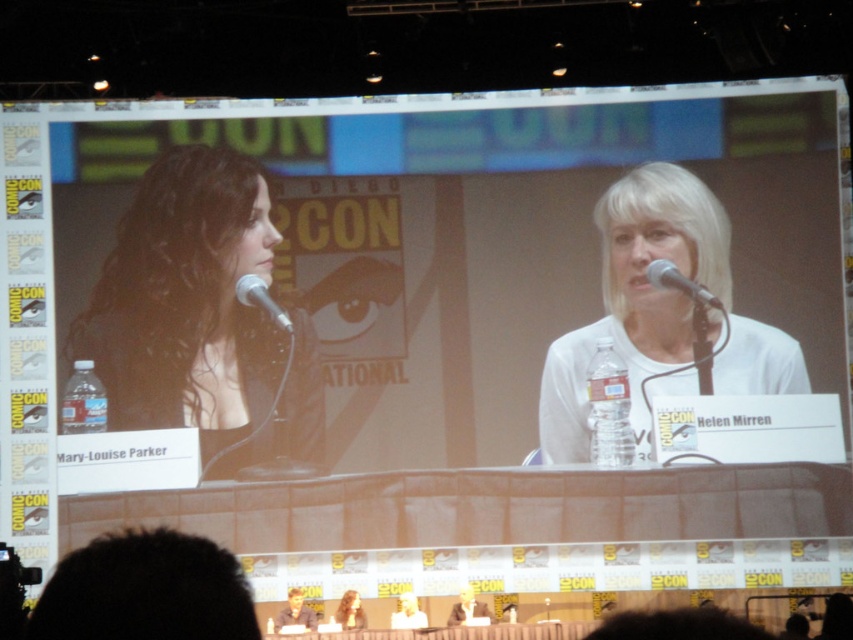
You are organizing a panel discussion and need to ensure that the shirts of the participants are visible to the audience. Based on the image provided, which participant has a wider shirt between the white matte shirt at center and the smooth white shirt at lower center?

The white matte shirt at center has a larger width than the smooth white shirt at lower center, so the white matte shirt at center is wider.

You are attending a Comic Con panel and want to know the seating arrangement of the speakers. Which speaker is positioned to the right side of the other one between the white matte shirt at center and the smooth white shirt at lower center?

The white matte shirt at center is positioned to the right of the smooth white shirt at lower center.

You are a photographer standing at the back of the hall. You want to take a photo of the smooth white shirt at center and the blonde hair at upper center so that both are clearly visible in the frame. Given that your camera has a maximum focus range of 5 meters, will you be able to capture both subjects within the same focused shot?

The smooth white shirt at center and the blonde hair at upper center are 5.87 meters apart from each other. Since the distance between them exceeds the camera maximum focus range of 5 meters, the photographer cannot capture both subjects within the same focused shot.